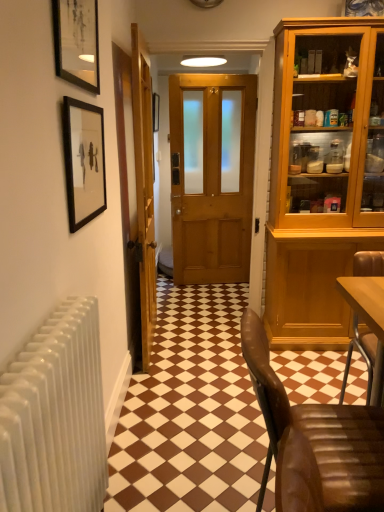
Question: Is matte black picture frame at upper left, which is the 1th picture frame in front-to-back order, to the left or to the right of wooden door at center, marked as the 2th door in a right-to-left arrangement, in the image?

Choices:
 (A) right
 (B) left

Answer: (B)

Question: Looking at the image, does matte black picture frame at upper left, which is counted as the second picture frame, starting from the bottom, seem bigger or smaller compared to wooden door at center, marked as the 2th door in a right-to-left arrangement?

Choices:
 (A) big
 (B) small

Answer: (B)

Question: Which object is positioned farthest from the brown leather chair at lower right?

Choices:
 (A) black matte picture frame at upper left, which appears as the 1th picture frame when ordered from the bottom
 (B) wooden door at center, the 1th door from the right
 (C) matte black picture frame at center, marked as the 1th picture frame in a back-to-front arrangement
 (D) wooden door at center, positioned as the first door in left-to-right order
 (E) matte black picture frame at upper left, which is the 1th picture frame in front-to-back order

Answer: (C)

Question: Considering the real-world distances, which object is farthest from the matte black picture frame at upper left, which is the 2th picture frame in top-to-bottom order?

Choices:
 (A) brown leather chair at lower right
 (B) wooden door at center, positioned as the 2th door in left-to-right order
 (C) matte black picture frame at center, positioned as the 1th picture frame in top-to-bottom order
 (D) black matte picture frame at upper left, the third picture frame in the top-to-bottom sequence
 (E) wooden door at center, marked as the 2th door in a right-to-left arrangement

Answer: (C)